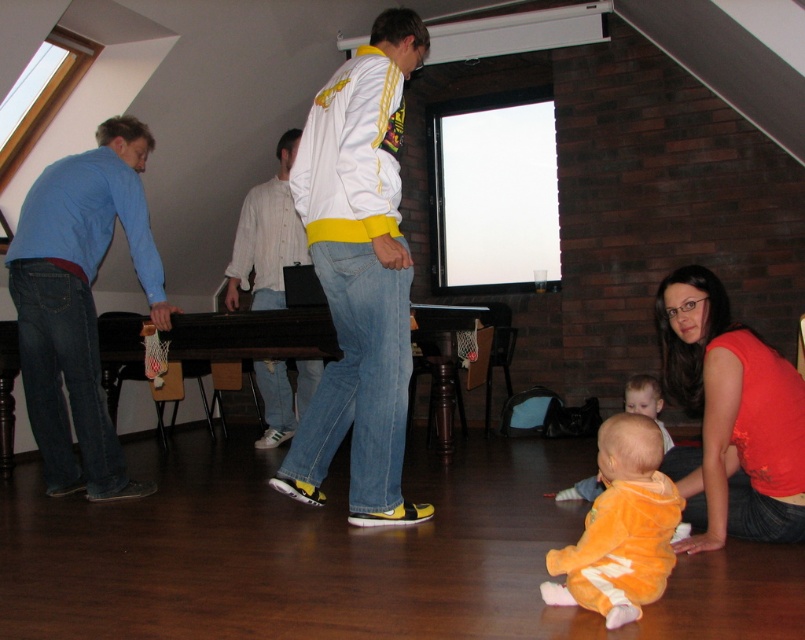
What do you see at coordinates (358, 275) in the screenshot?
I see `white matte jacket at center` at bounding box center [358, 275].

Does white matte jacket at center have a larger size compared to orange plush onesie at lower center?

Yes.

Who is more distant from viewer, (420,22) or (638,560)?

Point (420,22)

You are a GUI agent. You are given a task and a screenshot of the screen. Output one action in this format:
    pyautogui.click(x=<x>, y=<y>)
    Task: Click on the white matte jacket at center
    The image size is (805, 640).
    Given the screenshot: What is the action you would take?
    pyautogui.click(x=358, y=275)

Is blue cotton shirt at left positioned in front of orange plush baby at lower center?

No, blue cotton shirt at left is further to the viewer.

Is blue cotton shirt at left behind orange plush baby at lower center?

Yes, it is.

The width and height of the screenshot is (805, 640). I want to click on blue cotton shirt at left, so click(79, 301).

This screenshot has width=805, height=640. Find the location of `blue cotton shirt at left`. blue cotton shirt at left is located at coordinates 79,301.

Which is below, white matte jacket at center or blue cotton shirt at left?

Positioned lower is blue cotton shirt at left.

Between white matte jacket at center and blue cotton shirt at left, which one has less height?

With less height is blue cotton shirt at left.

Which is behind, point (325, 376) or point (101, 432)?

The point (101, 432) is behind.

Locate an element on the screen. This screenshot has width=805, height=640. white matte jacket at center is located at coordinates (358, 275).